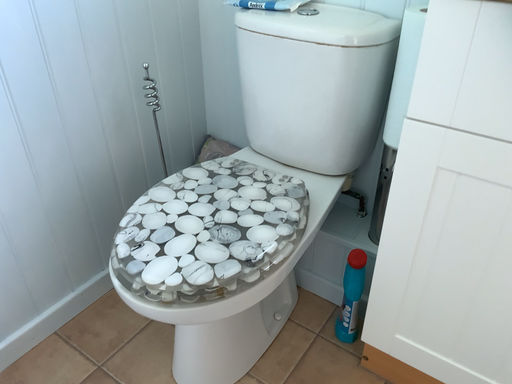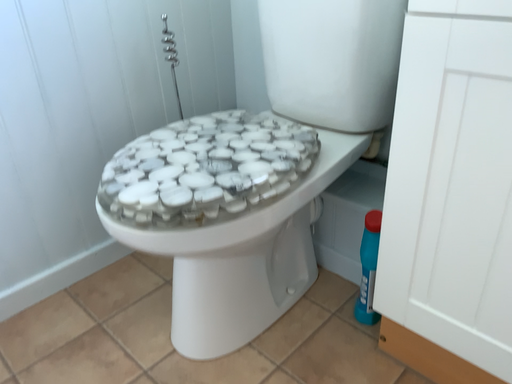
Question: How did the camera likely rotate when shooting the video?

Choices:
 (A) rotated left
 (B) rotated right

Answer: (A)